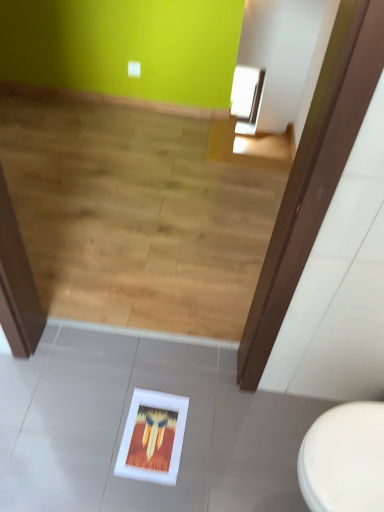
Question: Is white glossy toilet at lower right located within wooden floor at lower center?

Choices:
 (A) no
 (B) yes

Answer: (A)

Question: From a real-world perspective, is wooden floor at lower center positioned over white glossy toilet at lower right based on gravity?

Choices:
 (A) yes
 (B) no

Answer: (B)

Question: Is wooden floor at lower center positioned before white glossy toilet at lower right?

Choices:
 (A) no
 (B) yes

Answer: (A)

Question: Is wooden floor at lower center aimed at white glossy toilet at lower right?

Choices:
 (A) no
 (B) yes

Answer: (A)

Question: Considering the relative sizes of wooden floor at lower center and white glossy toilet at lower right in the image provided, is wooden floor at lower center bigger than white glossy toilet at lower right?

Choices:
 (A) no
 (B) yes

Answer: (B)

Question: Considering the positions of white matte picture frame at lower center and wooden floor at lower center in the image, is white matte picture frame at lower center wider or thinner than wooden floor at lower center?

Choices:
 (A) thin
 (B) wide

Answer: (A)

Question: Considering the positions of point (175, 480) and point (124, 259), is point (175, 480) closer or farther from the camera than point (124, 259)?

Choices:
 (A) farther
 (B) closer

Answer: (B)

Question: From a real-world perspective, relative to wooden floor at lower center, is white matte picture frame at lower center vertically above or below?

Choices:
 (A) above
 (B) below

Answer: (B)

Question: Is white matte picture frame at lower center bigger or smaller than wooden floor at lower center?

Choices:
 (A) small
 (B) big

Answer: (A)

Question: Considering the positions of white matte picture frame at lower center and white glossy toilet at lower right in the image, is white matte picture frame at lower center bigger or smaller than white glossy toilet at lower right?

Choices:
 (A) small
 (B) big

Answer: (A)

Question: Is point (137, 429) closer or farther from the camera than point (336, 505)?

Choices:
 (A) closer
 (B) farther

Answer: (B)

Question: In the image, is white matte picture frame at lower center on the left side or the right side of white glossy toilet at lower right?

Choices:
 (A) left
 (B) right

Answer: (A)

Question: Considering the positions of white matte picture frame at lower center and white glossy toilet at lower right in the image, is white matte picture frame at lower center taller or shorter than white glossy toilet at lower right?

Choices:
 (A) short
 (B) tall

Answer: (A)

Question: In terms of width, does wooden floor at lower center look wider or thinner when compared to white glossy toilet at lower right?

Choices:
 (A) wide
 (B) thin

Answer: (A)

Question: In terms of size, does wooden floor at lower center appear bigger or smaller than white glossy toilet at lower right?

Choices:
 (A) big
 (B) small

Answer: (A)